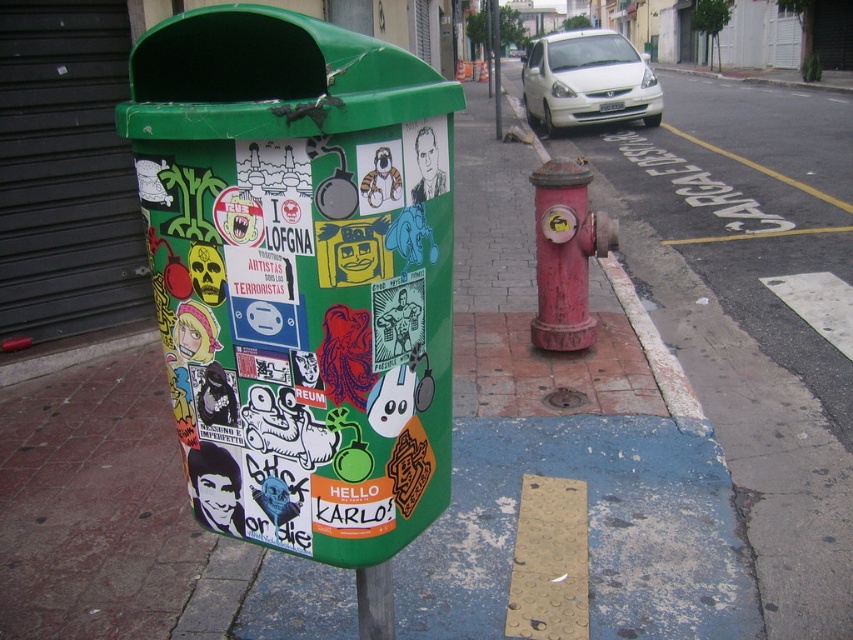
Question: Which point appears farthest from the camera in this image?

Choices:
 (A) (634, 321)
 (B) (399, 444)

Answer: (A)

Question: Is metallic pole at lower center below brushed metal pole at center?

Choices:
 (A) no
 (B) yes

Answer: (B)

Question: Which point appears closest to the camera in this image?

Choices:
 (A) (595, 323)
 (B) (215, 97)
 (C) (491, 19)

Answer: (B)

Question: Can you confirm if smooth concrete sidewalk at center is positioned below rusty metal hydrant at center?

Choices:
 (A) no
 (B) yes

Answer: (B)

Question: Can you confirm if green matte trash can at left is positioned below smooth concrete sidewalk at center?

Choices:
 (A) no
 (B) yes

Answer: (B)

Question: Which object appears farthest from the camera in this image?

Choices:
 (A) brushed metal pole at center
 (B) rusty metal hydrant at center
 (C) metallic pole at lower center
 (D) smooth concrete sidewalk at center

Answer: (A)